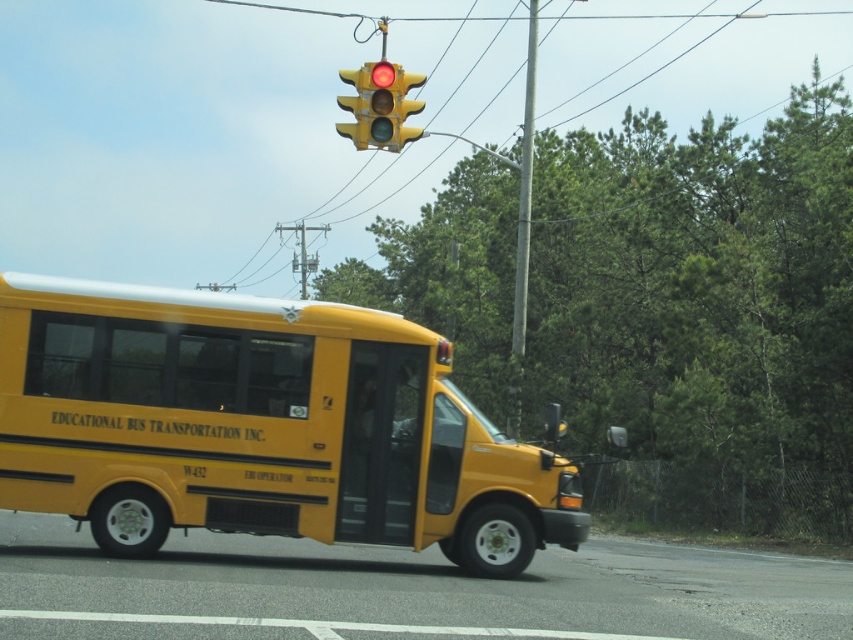
You are a traffic officer observing the yellow matte bus at center. According to the traffic light above it, what should the bus do next?

The traffic light above the yellow matte bus at center is red, so the bus must stop.

You are driving a car and see the yellow matte traffic light at upper center and the metallic gray pole at center. Which object is nearer to you?

The yellow matte traffic light at upper center is closer to the viewer than the metallic gray pole at center.